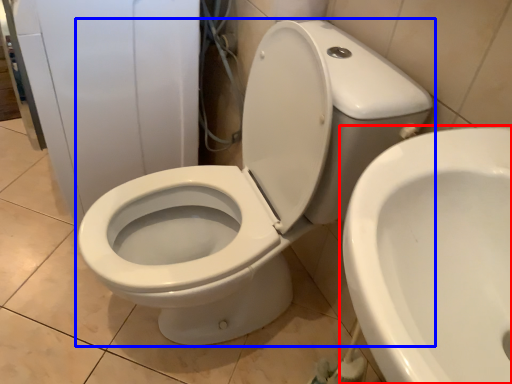
Question: Which point is further to the camera, toilet (highlighted by a red box) or toilet (highlighted by a blue box)?

Choices:
 (A) toilet
 (B) toilet

Answer: (B)